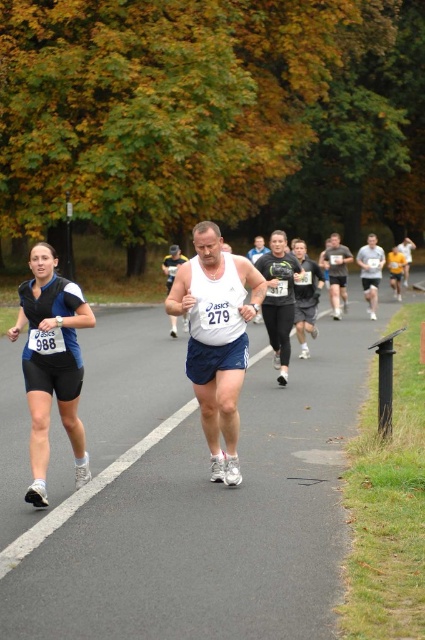
Between point (224, 314) and point (302, 268), which one is positioned in front?

Point (224, 314)

Is point (220, 456) in front of point (314, 300)?

That is True.

Locate an element on the screen. This screenshot has width=425, height=640. white matte tank top at center is located at coordinates (217, 339).

Is white tank top at center taller than white fabric shirt at center?

No.

Does point (172, 257) come closer to viewer compared to point (260, 316)?

No, it is behind (260, 316).

Locate an element on the screen. white tank top at center is located at coordinates (172, 264).

Is gray fabric shirt at right to the left of white fabric shirt at center from the viewer's perspective?

No, gray fabric shirt at right is not to the left of white fabric shirt at center.

Which is behind, point (376, 276) or point (248, 259)?

Point (376, 276)

Image resolution: width=425 pixels, height=640 pixels. What are the coordinates of `gray fabric shirt at right` in the screenshot? It's located at (371, 272).